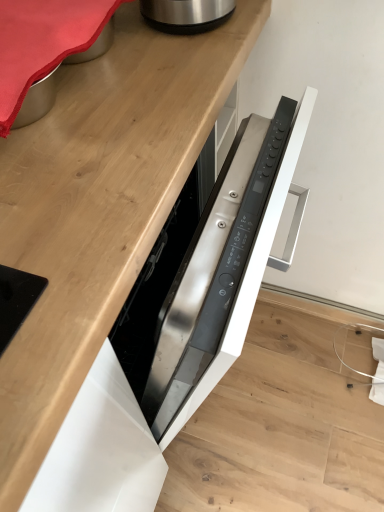
This screenshot has height=512, width=384. What do you see at coordinates (99, 208) in the screenshot? I see `wooden at upper left` at bounding box center [99, 208].

You are a GUI agent. You are given a task and a screenshot of the screen. Output one action in this format:
    pyautogui.click(x=<x>, y=<y>)
    Task: Click on the wooden at upper left
    
    Given the screenshot: What is the action you would take?
    pyautogui.click(x=99, y=208)

You are a GUI agent. You are given a task and a screenshot of the screen. Output one action in this format:
    pyautogui.click(x=<x>, y=<y>)
    Task: Click on the wooden at upper left
    The image size is (384, 512).
    Given the screenshot: What is the action you would take?
    pyautogui.click(x=99, y=208)